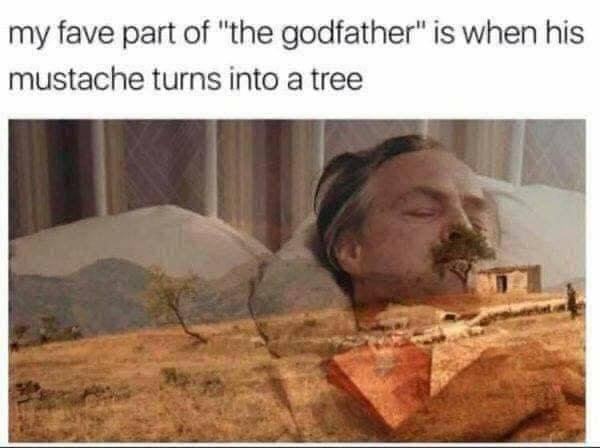
The height and width of the screenshot is (448, 600). I want to click on books, so click(388, 399), click(440, 371).